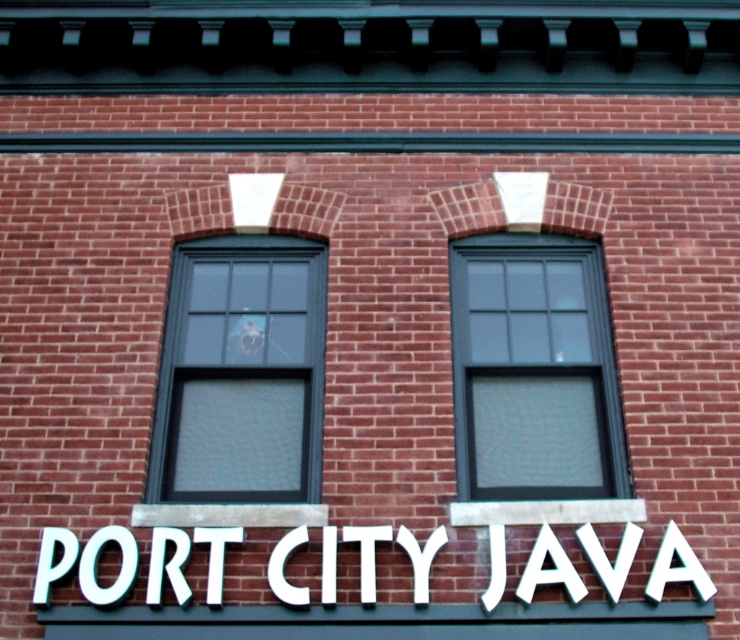
You are standing in front of the building and notice a point marked at coordinates (534, 371). What object is located at this point?

The point at (534, 371) is occupied by the matte black window at center.

You are standing in front of the building and want to place a small decoration between the two points, point (306, 449) and point (73, 556). Which point is closer to you so you can start placing the decoration from there?

Point (306, 449) is further to the viewer than point (73, 556), so the closer point to you is point (73, 556). Start placing the decoration from there.